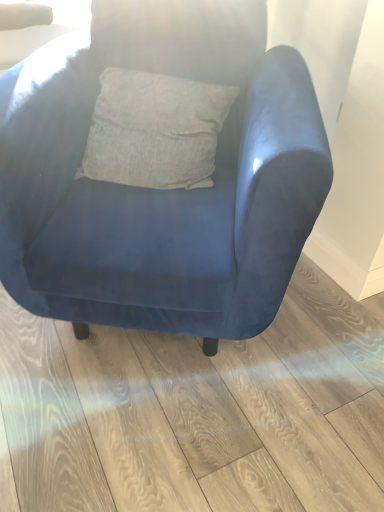
Image resolution: width=384 pixels, height=512 pixels. I want to click on velvet blue armchair at center, so click(x=158, y=206).

What do you see at coordinates (158, 206) in the screenshot? I see `velvet blue armchair at center` at bounding box center [158, 206].

At what (x,y) coordinates should I click in order to perform the action: click on blue velvet armchair at center. Please return your answer as a coordinate pair (x, y). The height and width of the screenshot is (512, 384). Looking at the image, I should click on (197, 412).

Describe the element at coordinates (197, 412) in the screenshot. I see `blue velvet armchair at center` at that location.

The height and width of the screenshot is (512, 384). Find the location of `velvet blue armchair at center`. velvet blue armchair at center is located at coordinates (158, 206).

Is blue velvet armchair at center to the left or to the right of velvet blue armchair at center in the image?

Based on their positions, blue velvet armchair at center is located to the right of velvet blue armchair at center.

Between blue velvet armchair at center and velvet blue armchair at center, which one is positioned behind?

Positioned behind is blue velvet armchair at center.

Is point (244, 361) positioned behind point (84, 132)?

Yes, point (244, 361) is farther from viewer.

From the image's perspective, which is below, blue velvet armchair at center or velvet blue armchair at center?

blue velvet armchair at center.

From a real-world perspective, is blue velvet armchair at center located higher than velvet blue armchair at center?

No, from a real-world perspective, blue velvet armchair at center is not above velvet blue armchair at center.

Considering the sizes of objects blue velvet armchair at center and velvet blue armchair at center in the image provided, who is wider, blue velvet armchair at center or velvet blue armchair at center?

blue velvet armchair at center is wider.

Considering the relative sizes of blue velvet armchair at center and velvet blue armchair at center in the image provided, is blue velvet armchair at center taller than velvet blue armchair at center?

No.

Based on their sizes in the image, would you say blue velvet armchair at center is bigger or smaller than velvet blue armchair at center?

blue velvet armchair at center is smaller than velvet blue armchair at center.

Is blue velvet armchair at center not within velvet blue armchair at center?

Indeed, blue velvet armchair at center is completely outside velvet blue armchair at center.

Would you consider blue velvet armchair at center to be distant from velvet blue armchair at center?

No, blue velvet armchair at center is not far away from velvet blue armchair at center.

Is blue velvet armchair at center aimed at velvet blue armchair at center?

No, blue velvet armchair at center is not aimed at velvet blue armchair at center.

Locate an element on the screen. Image resolution: width=384 pixels, height=512 pixels. chair that appears above the blue velvet armchair at center (from a real-world perspective) is located at coordinates (158, 206).

Does velvet blue armchair at center appear on the left side of blue velvet armchair at center?

Indeed, velvet blue armchair at center is positioned on the left side of blue velvet armchair at center.

Who is more distant, velvet blue armchair at center or blue velvet armchair at center?

Positioned behind is blue velvet armchair at center.

Which point is more forward, (259,304) or (260,475)?

Positioned in front is point (260,475).

Consider the image. From the image's perspective, which is below, velvet blue armchair at center or blue velvet armchair at center?

From the image's view, blue velvet armchair at center is below.

From a real-world perspective, is velvet blue armchair at center beneath blue velvet armchair at center?

No, from a real-world perspective, velvet blue armchair at center is not under blue velvet armchair at center.

Considering the sizes of velvet blue armchair at center and blue velvet armchair at center in the image, is velvet blue armchair at center wider or thinner than blue velvet armchair at center?

In the image, velvet blue armchair at center appears to be more narrow than blue velvet armchair at center.

Based on the photo, can you confirm if velvet blue armchair at center is shorter than blue velvet armchair at center?

No, velvet blue armchair at center is not shorter than blue velvet armchair at center.

Which of these two, velvet blue armchair at center or blue velvet armchair at center, is smaller?

Smaller between the two is blue velvet armchair at center.

Is blue velvet armchair at center a part of velvet blue armchair at center?

No, blue velvet armchair at center is not a part of velvet blue armchair at center.

Is velvet blue armchair at center placed right next to blue velvet armchair at center?

velvet blue armchair at center and blue velvet armchair at center are not in contact.

Is velvet blue armchair at center facing away from blue velvet armchair at center?

That's not correct — velvet blue armchair at center is not looking away from blue velvet armchair at center.

What's the angular difference between velvet blue armchair at center and blue velvet armchair at center's facing directions?

57 degrees separate the facing orientations of velvet blue armchair at center and blue velvet armchair at center.

Measure the distance between velvet blue armchair at center and blue velvet armchair at center.

velvet blue armchair at center and blue velvet armchair at center are 15.63 inches apart from each other.

At what (x,y) coordinates should I click in order to perform the action: click on plank below the velvet blue armchair at center (from the image's perspective). Please return your answer as a coordinate pair (x, y). This screenshot has width=384, height=512. Looking at the image, I should click on (197, 412).

Image resolution: width=384 pixels, height=512 pixels. What are the coordinates of `plank lying below the velvet blue armchair at center (from the image's perspective)` in the screenshot? It's located at click(197, 412).

Where is `chair above the blue velvet armchair at center (from a real-world perspective)`? chair above the blue velvet armchair at center (from a real-world perspective) is located at coordinates (158, 206).